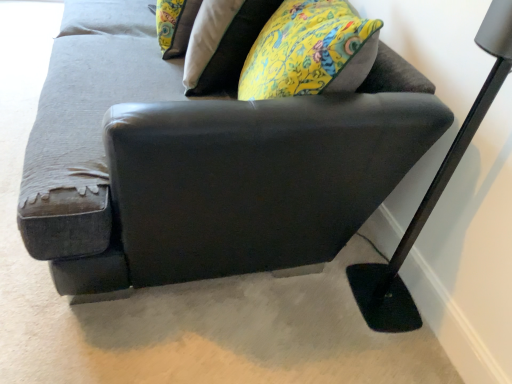
Question: Is black metal floor lamp at lower right wider or thinner than floral fabric pillow at upper center?

Choices:
 (A) thin
 (B) wide

Answer: (A)

Question: Do you think black metal floor lamp at lower right is within floral fabric pillow at upper center, or outside of it?

Choices:
 (A) inside
 (B) outside

Answer: (B)

Question: Which is nearer to the black metal floor lamp at lower right?

Choices:
 (A) dark gray fabric couch at center
 (B) floral fabric pillow at upper center

Answer: (A)

Question: Which of these objects is positioned farthest from the black metal floor lamp at lower right?

Choices:
 (A) floral fabric pillow at upper center
 (B) dark gray fabric couch at center

Answer: (A)